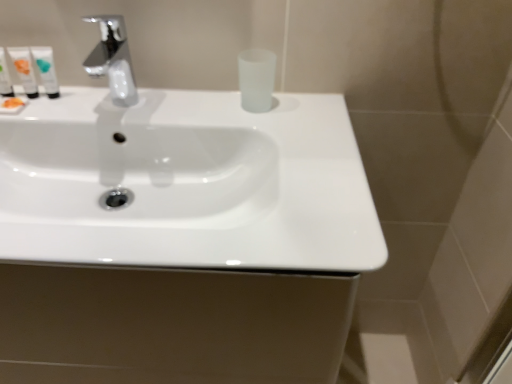
Locate an element on the screen. This screenshot has width=512, height=384. free spot to the right of white glossy tube at upper left, positioned as the third mouthwash in left-to-right order is located at coordinates (124, 117).